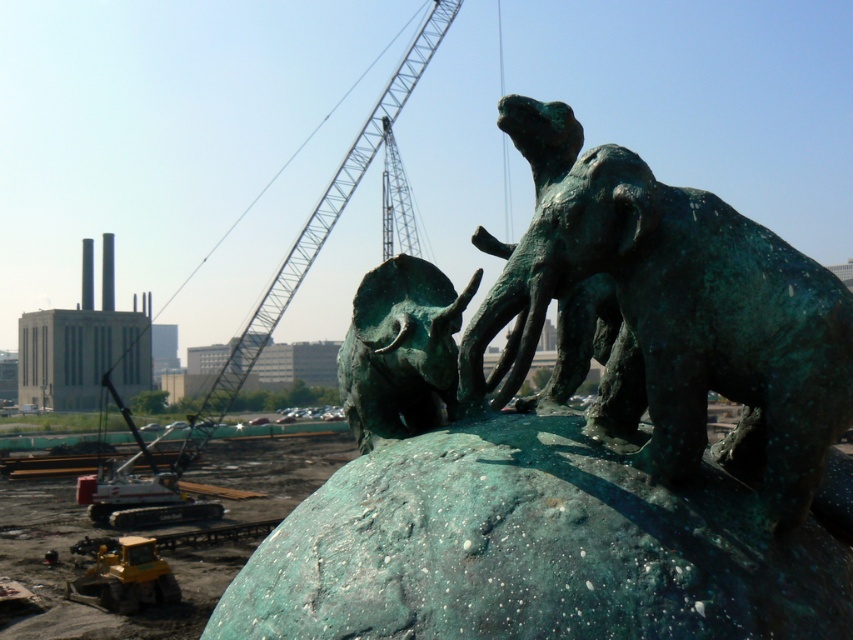
You are an architect observing the construction site and the historical statue. You need to determine the spatial relationship between the green patina bronze elephant at center and the greenish metallic crane at upper center. Which object is positioned higher in the image?

The greenish metallic crane at upper center is positioned higher than the green patina bronze elephant at center.

You are an urban planner assessing the space between the green patina bronze elephant at center and the greenish metallic crane at upper center. Given that the elephant is smaller, how might this affect the visual balance of the scene?

The green patina bronze elephant at center is smaller than the greenish metallic crane at upper center, which could create an imbalance as the larger crane might dominate the visual focus, making the elephant appear less prominent.